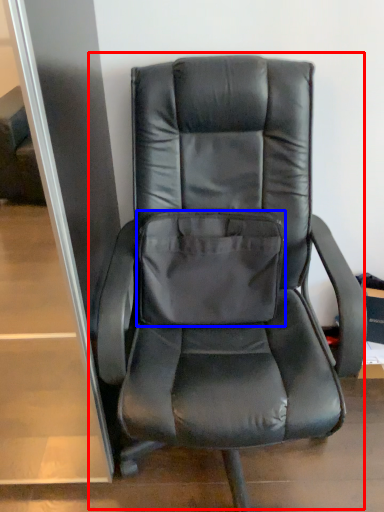
Question: Which point is closer to the camera, chair (highlighted by a red box) or pocket (highlighted by a blue box)?

Choices:
 (A) chair
 (B) pocket

Answer: (A)